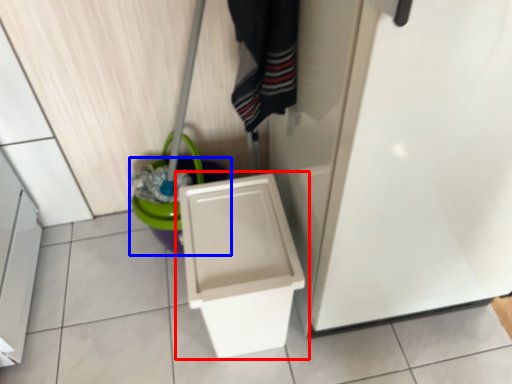
Question: Which point is closer to the camera, toilet (highlighted by a red box) or potty (highlighted by a blue box)?

Choices:
 (A) toilet
 (B) potty

Answer: (A)